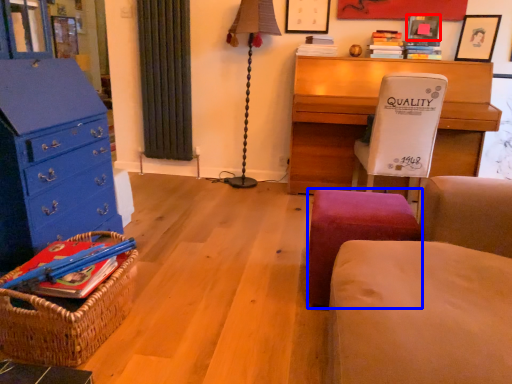
Question: Among these objects, which one is farthest to the camera, picture frame (highlighted by a red box) or stool (highlighted by a blue box)?

Choices:
 (A) picture frame
 (B) stool

Answer: (A)